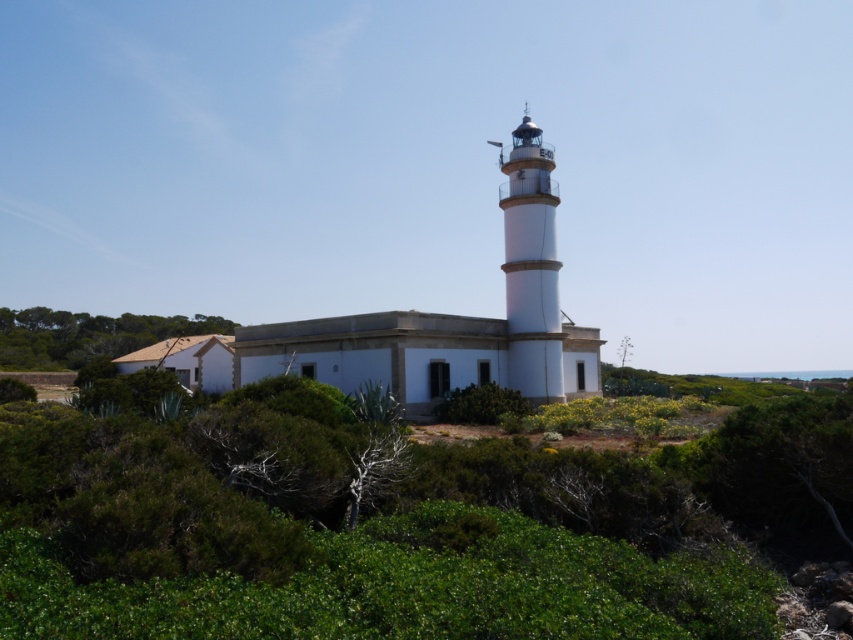
Question: Which point is farther from the camera taking this photo?

Choices:
 (A) (94, 529)
 (B) (199, 326)
 (C) (538, 189)

Answer: (B)

Question: Can you confirm if green leafy shrubs at center is positioned above white smooth tower at center?

Choices:
 (A) no
 (B) yes

Answer: (A)

Question: Which point is farther to the camera?

Choices:
 (A) green leafy shrubs at center
 (B) green leafy shrubs at lower left
 (C) white smooth tower at center

Answer: (B)

Question: Which object is the closest to the green leafy shrubs at lower left?

Choices:
 (A) green leafy shrubs at center
 (B) white smooth tower at center

Answer: (B)

Question: Does white smooth tower at center have a smaller size compared to green leafy shrubs at lower left?

Choices:
 (A) no
 (B) yes

Answer: (B)

Question: Is white smooth tower at center further to camera compared to green leafy shrubs at lower left?

Choices:
 (A) yes
 (B) no

Answer: (B)